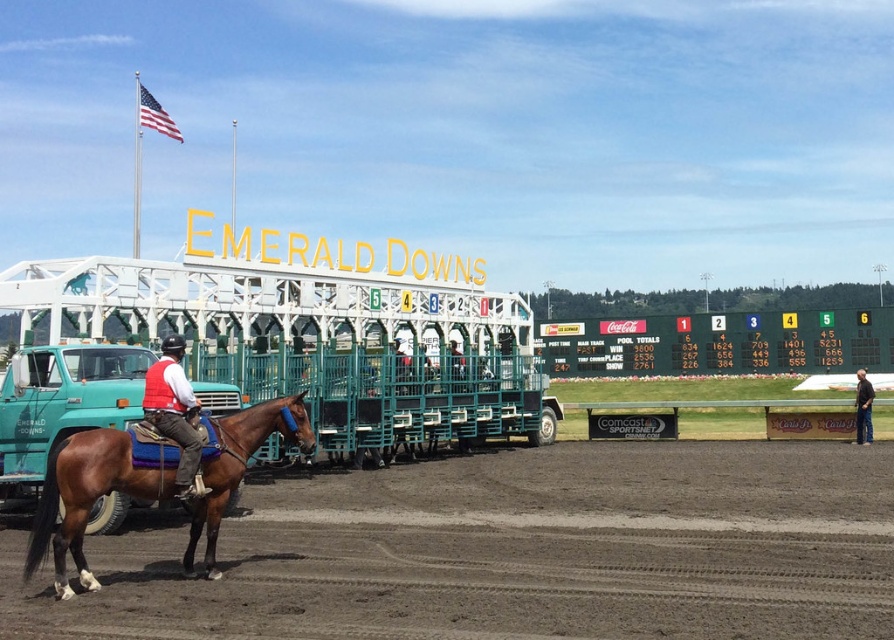
Which is below, green plastic scoreboard at center or teal matte truck at left?

green plastic scoreboard at center

Does green plastic scoreboard at center lie behind teal matte truck at left?

Yes, it is.

Who is more forward, (648, 320) or (115, 416)?

Point (115, 416) is more forward.

Locate an element on the screen. green plastic scoreboard at center is located at coordinates (718, 342).

The width and height of the screenshot is (894, 640). What do you see at coordinates (86, 497) in the screenshot?
I see `brown glossy horse at center` at bounding box center [86, 497].

You are a GUI agent. You are given a task and a screenshot of the screen. Output one action in this format:
    pyautogui.click(x=<x>, y=<y>)
    Task: Click on the brown glossy horse at center
    The height and width of the screenshot is (640, 894).
    Given the screenshot: What is the action you would take?
    pyautogui.click(x=86, y=497)

Based on the photo, can you confirm if green plastic scoreboard at center is thinner than brown glossy horse at center?

Incorrect, green plastic scoreboard at center's width is not less than brown glossy horse at center's.

Where is `green plastic scoreboard at center`? Image resolution: width=894 pixels, height=640 pixels. green plastic scoreboard at center is located at coordinates (718, 342).

At what (x,y) coordinates should I click in order to perform the action: click on green plastic scoreboard at center. Please return your answer as a coordinate pair (x, y). Looking at the image, I should click on (718, 342).

This screenshot has height=640, width=894. I want to click on green plastic scoreboard at center, so click(718, 342).